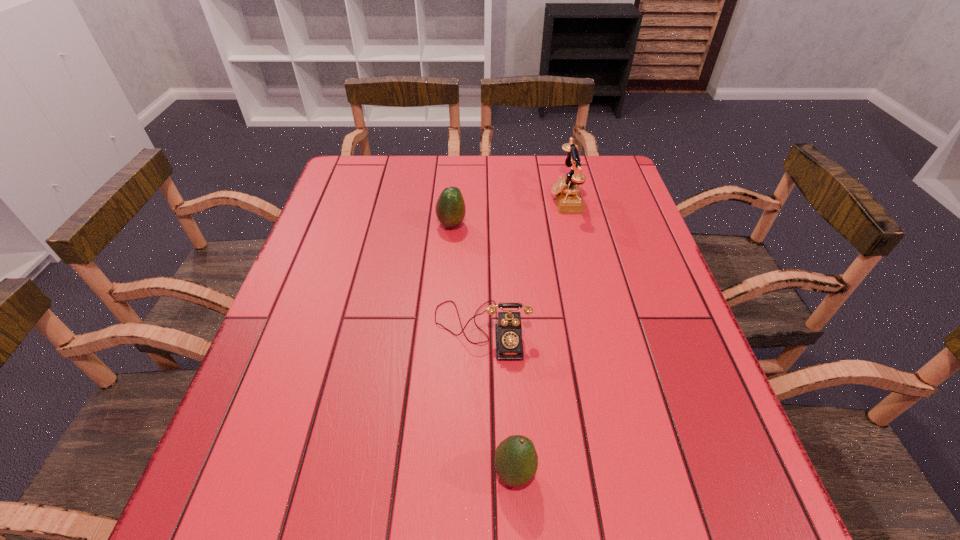
What are the coordinates of `blank space located on the back of the farther avocado` in the screenshot? It's located at (454, 187).

You are a GUI agent. You are given a task and a screenshot of the screen. Output one action in this format:
    pyautogui.click(x=<x>, y=<y>)
    Task: Click on the free region located 0.280m on the back of the nearer avocado
    The height and width of the screenshot is (540, 960).
    Given the screenshot: What is the action you would take?
    pyautogui.click(x=506, y=325)

Find the location of a particular element. free space located on the dial of the left telephone is located at coordinates (482, 427).

Locate an element on the screen. This screenshot has height=540, width=960. object that is at the far edge is located at coordinates (566, 190).

Image resolution: width=960 pixels, height=540 pixels. I want to click on object that is at the near edge, so click(516, 461).

Locate an element on the screen. object that is positioned at the right edge is located at coordinates coord(566,190).

Where is `object present at the far right corner`? The height and width of the screenshot is (540, 960). object present at the far right corner is located at coordinates (566, 190).

Locate an element on the screen. vacant space at the far edge of the desktop is located at coordinates (511, 156).

The width and height of the screenshot is (960, 540). I want to click on free space at the left edge, so click(x=277, y=362).

Identify the location of vacant point at the right edge. This screenshot has height=540, width=960. (632, 332).